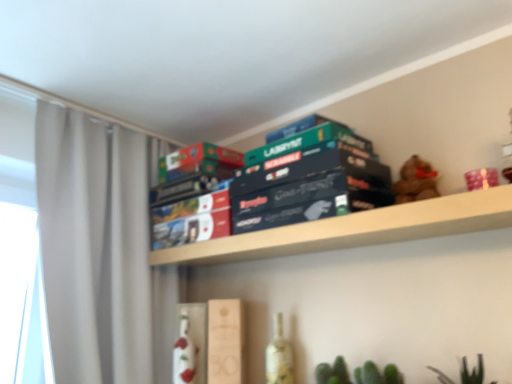
Describe the element at coordinates (295, 142) in the screenshot. I see `green matte board game at upper center, the 1th paperback book when ordered from top to bottom` at that location.

Find the location of a particular element. The height and width of the screenshot is (384, 512). white glass bottle at lower center, which is the 1th bottle from right to left is located at coordinates (279, 356).

Identify the location of green matte board game box at center, the 2th paperback book from the top. (199, 162).

Measure the distance between point [194,347] and camera.

The distance of point [194,347] from camera is 4.87 feet.

Locate an element on the screen. This screenshot has width=512, height=384. dark blue cardboard game box at center is located at coordinates (308, 179).

Which object is further away from the camera taking this photo, green matte board game at upper center, the 1th paperback book when ordered from top to bottom, or green matte board game at center, marked as the 3th paperback book in a top-to-bottom arrangement?

green matte board game at upper center, the 1th paperback book when ordered from top to bottom, is further away from the camera.

From a real-world perspective, is green matte board game at upper center, which ranks as the 4th paperback book in bottom-to-top order, below green matte board game at center, positioned as the 2th paperback book in bottom-to-top order?

No.

Would you say green matte board game at upper center, the 1th paperback book when ordered from top to bottom, is outside green matte board game at center, positioned as the 2th paperback book in bottom-to-top order?

Yes, green matte board game at upper center, the 1th paperback book when ordered from top to bottom, is located beyond the bounds of green matte board game at center, positioned as the 2th paperback book in bottom-to-top order.

Is green matte board game at center, marked as the 3th paperback book in a top-to-bottom arrangement, at the back of green matte board game at upper center, the 1th paperback book when ordered from top to bottom?

green matte board game at upper center, the 1th paperback book when ordered from top to bottom, is not turned away from green matte board game at center, marked as the 3th paperback book in a top-to-bottom arrangement.

From a real-world perspective, relative to white glass bottle at lower center, which is the 1th bottle from right to left, is green matte board game box at center, the 3th paperback book from the bottom, vertically above or below?

Clearly, from a real-world perspective, green matte board game box at center, the 3th paperback book from the bottom, is above white glass bottle at lower center, which is the 1th bottle from right to left.

Is green matte board game box at center, the 3th paperback book from the bottom, at the left side of white glass bottle at lower center, which is counted as the 2th bottle, starting from the left?

Correct, you'll find green matte board game box at center, the 3th paperback book from the bottom, to the left of white glass bottle at lower center, which is counted as the 2th bottle, starting from the left.

Does green matte board game box at center, the 3th paperback book from the bottom, have a lesser height compared to white glass bottle at lower center, which is counted as the 2th bottle, starting from the left?

Yes, green matte board game box at center, the 3th paperback book from the bottom, is shorter than white glass bottle at lower center, which is counted as the 2th bottle, starting from the left.

There is a white glass bottle at lower center, which is counted as the 2th bottle, starting from the left. Identify the location of the 3rd paperback book above it (from a real-world perspective). (199, 162).

Is white glossy bottle at center, which is the second bottle in right-to-left order, at the back of green matte board game at upper center, the 1th paperback book when ordered from top to bottom?

green matte board game at upper center, the 1th paperback book when ordered from top to bottom, is not turned away from white glossy bottle at center, which is the second bottle in right-to-left order.

Could white glossy bottle at center, which is the second bottle in right-to-left order, be considered to be inside green matte board game at upper center, the 1th paperback book when ordered from top to bottom?

No, white glossy bottle at center, which is the second bottle in right-to-left order, is not inside green matte board game at upper center, the 1th paperback book when ordered from top to bottom.

This screenshot has width=512, height=384. Identify the location of the 4th paperback book above the white glossy bottle at center, the 1th bottle in the left-to-right sequence (from the image's perspective). (295, 142).

From the picture: Considering the relative positions of wooden shelf at upper center and white glossy bottle at center, the 1th bottle in the left-to-right sequence, in the image provided, is wooden shelf at upper center to the left or to the right of white glossy bottle at center, the 1th bottle in the left-to-right sequence,?

wooden shelf at upper center is positioned on white glossy bottle at center, the 1th bottle in the left-to-right sequence,'s right side.

Is wooden shelf at upper center placed right next to white glossy bottle at center, the 1th bottle in the left-to-right sequence?

They are not placed beside each other.

Based on the photo, considering the sizes of wooden shelf at upper center and white glossy bottle at center, which is the second bottle in right-to-left order, in the image, is wooden shelf at upper center taller or shorter than white glossy bottle at center, which is the second bottle in right-to-left order,?

In the image, wooden shelf at upper center appears to be shorter than white glossy bottle at center, which is the second bottle in right-to-left order.

Which is further, (x=260, y=255) or (x=190, y=339)?

The point (x=190, y=339) is farther from the camera.

Is white fabric curtain at left wider than white glossy bottle at center, which is the second bottle in right-to-left order?

Indeed, white fabric curtain at left has a greater width compared to white glossy bottle at center, which is the second bottle in right-to-left order.

From a real-world perspective, is white fabric curtain at left positioned above or below white glossy bottle at center, which is the second bottle in right-to-left order?

white fabric curtain at left is situated higher than white glossy bottle at center, which is the second bottle in right-to-left order, in the real world.

Between white fabric curtain at left and white glossy bottle at center, which is the second bottle in right-to-left order, which one has larger size?

Bigger between the two is white fabric curtain at left.

Relative to white glass bottle at lower center, which is counted as the 2th bottle, starting from the left, is wooden shelf at upper center in front or behind?

wooden shelf at upper center is positioned closer to the viewer than white glass bottle at lower center, which is counted as the 2th bottle, starting from the left.

From the picture: From a real-world perspective, is wooden shelf at upper center beneath white glass bottle at lower center, which is counted as the 2th bottle, starting from the left?

Actually, wooden shelf at upper center is physically above white glass bottle at lower center, which is counted as the 2th bottle, starting from the left, in the real world.

Is wooden shelf at upper center spatially inside white glass bottle at lower center, which is counted as the 2th bottle, starting from the left, or outside of it?

wooden shelf at upper center cannot be found inside white glass bottle at lower center, which is counted as the 2th bottle, starting from the left.

From a real-world perspective, which is physically above, dark blue cardboard game box at center or green matte plant at lower center, the 2th plant viewed from the top?

From a 3D spatial view, dark blue cardboard game box at center is above.

Can you confirm if dark blue cardboard game box at center is shorter than green matte plant at lower center, marked as the 1th plant in a bottom-to-top arrangement?

Yes.

Locate an element on the screen. the 2nd plant located beneath the dark blue cardboard game box at center (from a real-world perspective) is located at coordinates (377, 374).

How different are the orientations of dark blue cardboard game box at center and green matte plant at lower center, marked as the 1th plant in a bottom-to-top arrangement, in degrees?

The facing directions of dark blue cardboard game box at center and green matte plant at lower center, marked as the 1th plant in a bottom-to-top arrangement, are 2.66 degrees apart.

Identify the location of the 2nd paperback book located beneath the green matte board game at upper center, the 1th paperback book when ordered from top to bottom (from a real-world perspective). (309, 167).

The image size is (512, 384). I want to click on paperback book that is the 3rd one above the white glass bottle at lower center, which is the 1th bottle from right to left (from a real-world perspective), so click(199, 162).

Which object lies nearer to the anchor point wooden shelf at upper center, white fabric curtain at left or white glass bottle at lower center, which is the 1th bottle from right to left?

The object closer to wooden shelf at upper center is white fabric curtain at left.

Which object lies further to the anchor point green matte plant at lower center, which is the second plant from bottom to top, green matte board game box at center, the 2th paperback book from the top, or green matte board game at center, marked as the 3th paperback book in a top-to-bottom arrangement?

green matte board game box at center, the 2th paperback book from the top, lies further to green matte plant at lower center, which is the second plant from bottom to top, than the other object.

From the image, which object appears to be nearer to green matte board game at center, positioned as the 2th paperback book in bottom-to-top order, wooden shelf at upper center or green matte board game box at center, the 2th paperback book from the top?

Among the two, wooden shelf at upper center is located nearer to green matte board game at center, positioned as the 2th paperback book in bottom-to-top order.

Looking at the image, which one is located closer to white glass bottle at lower center, which is the 1th bottle from right to left, green matte board game box at center, the 2th paperback book from the top, or wooden shelf at upper center?

The object closer to white glass bottle at lower center, which is the 1th bottle from right to left, is wooden shelf at upper center.

When comparing their distances from green matte board game at center, positioned as the 2th paperback book in bottom-to-top order, does white fabric curtain at left or white glossy bottle at center, which is the second bottle in right-to-left order, seem further?

white glossy bottle at center, which is the second bottle in right-to-left order, is further to green matte board game at center, positioned as the 2th paperback book in bottom-to-top order.

Considering their positions, is white glossy bottle at center, which is the second bottle in right-to-left order, positioned further to green matte plant at lower center, which is the 1th plant in top-to-bottom order, than wooden shelf at upper center?

The object further to green matte plant at lower center, which is the 1th plant in top-to-bottom order, is white glossy bottle at center, which is the second bottle in right-to-left order.

From the image, which object appears to be farther from green matte board game box at center, the 2th paperback book from the top, wooden box at center, the 1th paperback book when ordered from bottom to top, or wooden shelf at upper center?

wooden box at center, the 1th paperback book when ordered from bottom to top.

In the scene shown: Looking at the image, which one is located further to wooden box at center, marked as the 4th paperback book in a top-to-bottom arrangement, green matte plant at lower center, marked as the 1th plant in a bottom-to-top arrangement, or white glossy bottle at center, which is the second bottle in right-to-left order?

green matte plant at lower center, marked as the 1th plant in a bottom-to-top arrangement.

In order to click on bottle between white glossy bottle at center, which is the second bottle in right-to-left order, and green matte plant at lower center, the 2th plant viewed from the top, from left to right in this screenshot , I will do `click(279, 356)`.

The height and width of the screenshot is (384, 512). I want to click on shelf between green matte board game at center, marked as the 3th paperback book in a top-to-bottom arrangement, and wooden box at center, marked as the 4th paperback book in a top-to-bottom arrangement, vertically, so click(357, 229).

Where is `book between green matte plant at lower center, which is the second plant from bottom to top, and green matte board game box at center, the 3th paperback book from the bottom, from front to back`? book between green matte plant at lower center, which is the second plant from bottom to top, and green matte board game box at center, the 3th paperback book from the bottom, from front to back is located at coordinates (308, 179).

Find the location of a particular element. bottle between white glossy bottle at center, which is the second bottle in right-to-left order, and green matte plant at lower center, which is the 1th plant in top-to-bottom order is located at coordinates (279, 356).